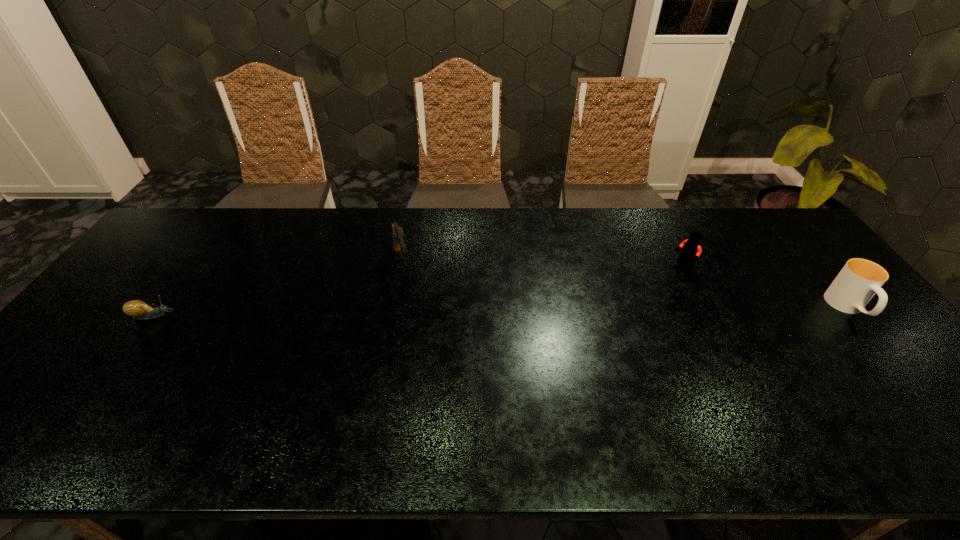
Find the location of `vacant space at the far left corner of the desktop`. vacant space at the far left corner of the desktop is located at coordinates (168, 250).

This screenshot has width=960, height=540. In order to click on free area in between the third object from left to right and the cup in this screenshot , I will do `click(766, 287)`.

This screenshot has width=960, height=540. Find the location of `vacant region between the shortest object and the rightmost object`. vacant region between the shortest object and the rightmost object is located at coordinates (501, 312).

Where is `vacant region between the second object from right to left and the leftmost object`? The width and height of the screenshot is (960, 540). vacant region between the second object from right to left and the leftmost object is located at coordinates (419, 291).

Identify the location of free spot between the leftmost object and the Lego. (419, 291).

Locate an element on the screen. This screenshot has width=960, height=540. empty space that is in between the rightmost object and the third object from left to right is located at coordinates (766, 287).

You are a GUI agent. You are given a task and a screenshot of the screen. Output one action in this format:
    pyautogui.click(x=<x>, y=<y>)
    Task: Click on the free space between the gun and the cup
    The image size is (960, 540).
    Given the screenshot: What is the action you would take?
    pyautogui.click(x=626, y=285)

The height and width of the screenshot is (540, 960). What are the coordinates of `vacant area that lies between the second object from left to right and the shortest object` in the screenshot? It's located at (278, 289).

Locate an element on the screen. free spot between the Lego and the rightmost object is located at coordinates (766, 287).

The image size is (960, 540). In order to click on empty space between the gun and the cup in this screenshot , I will do `click(626, 285)`.